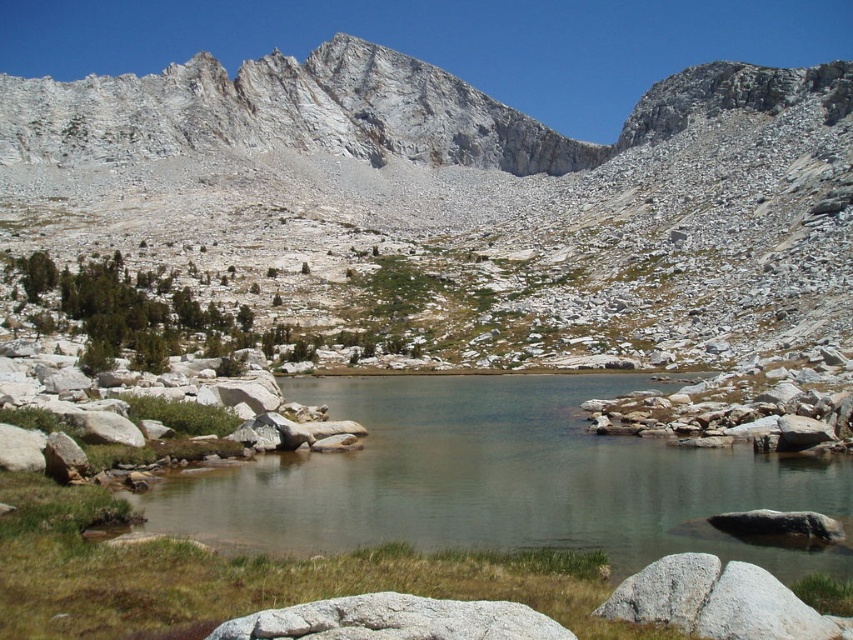
Is white rocky mountain at upper center wider than clear water at center?

Correct, the width of white rocky mountain at upper center exceeds that of clear water at center.

The height and width of the screenshot is (640, 853). In order to click on white rocky mountain at upper center in this screenshot , I will do click(x=462, y=193).

The height and width of the screenshot is (640, 853). What are the coordinates of `white rocky mountain at upper center` in the screenshot? It's located at (462, 193).